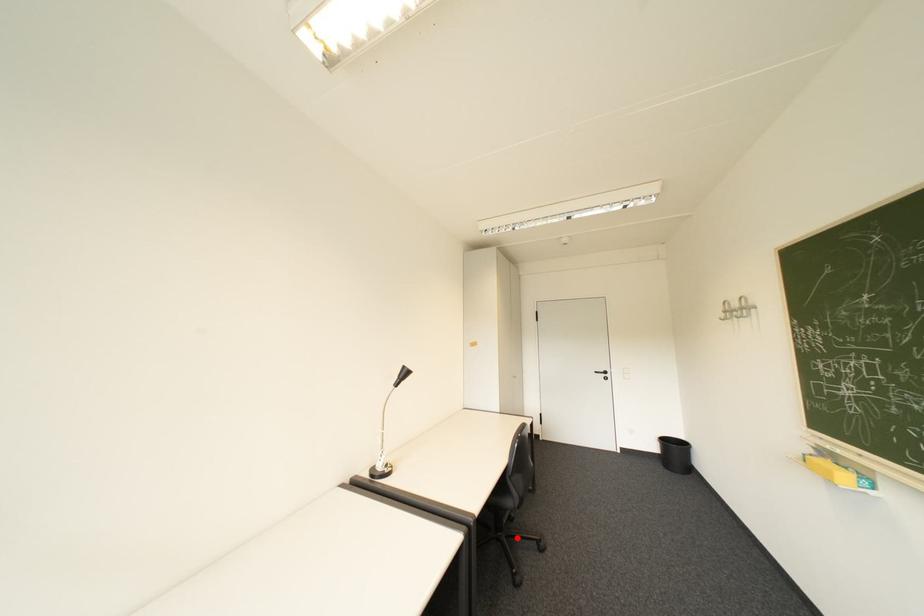
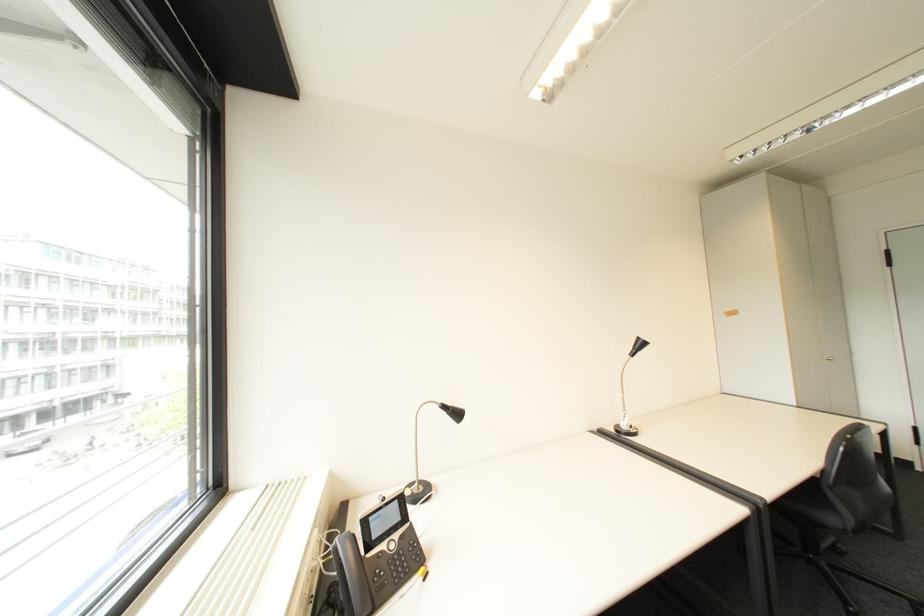
Locate, in the second image, the point that corresponds to the highlighted location in the first image.

(840, 567)